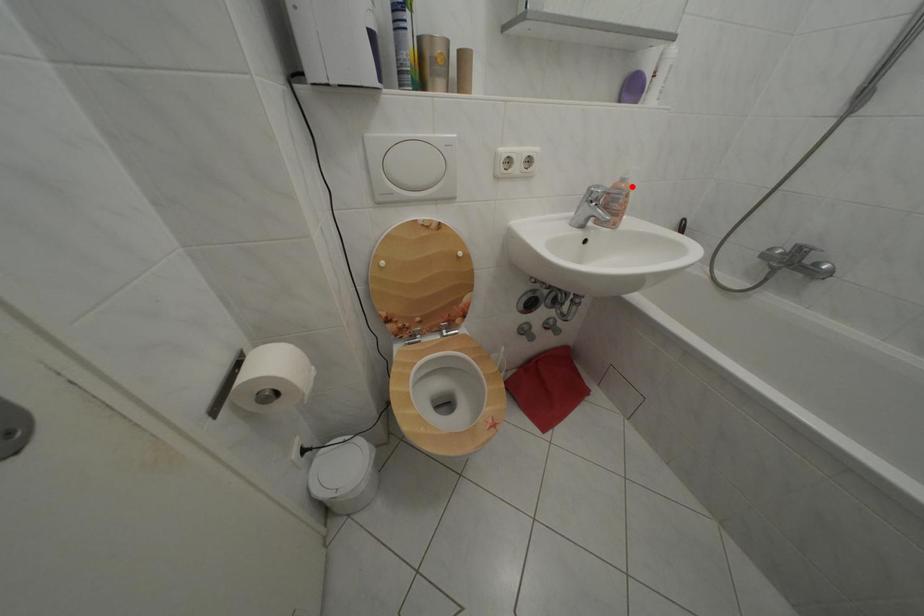
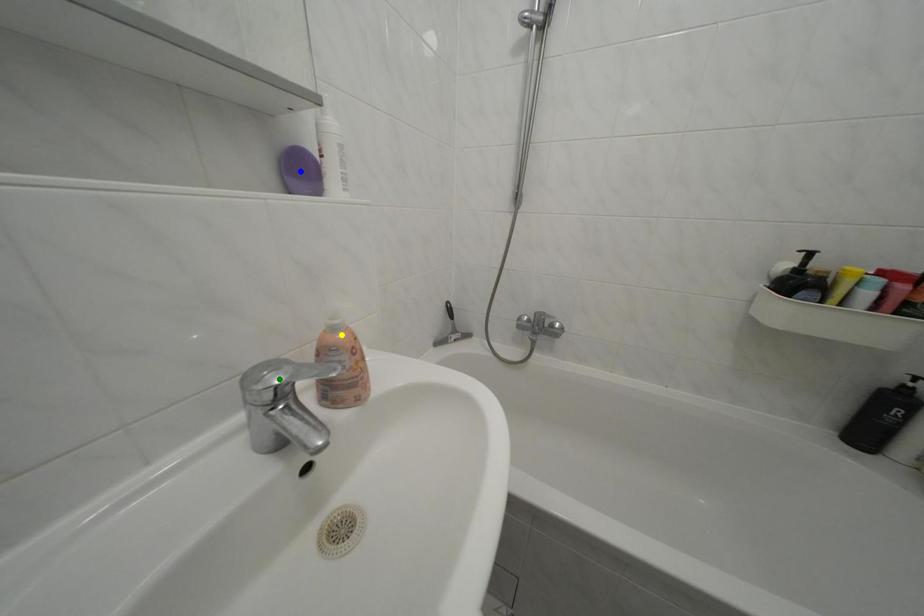
Question: I am providing you with two images of the same scene from different viewpoints. A red point is marked on the first image. You are given multiple points on the second image. Can you choose the point in image 2 that corresponds to the point in image 1?

Choices:
 (A) green point
 (B) blue point
 (C) yellow point

Answer: (C)